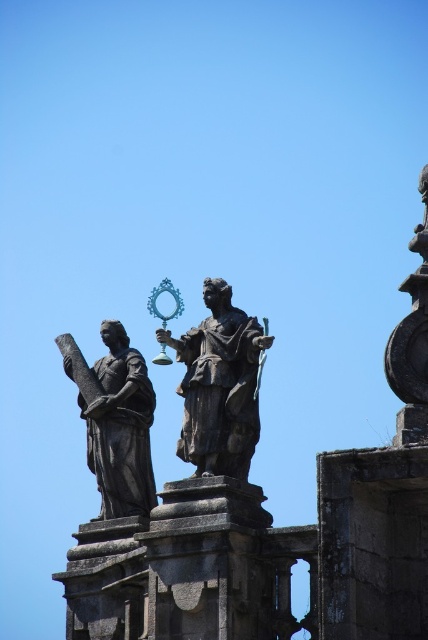
In the scene shown: Is polished bronze statue at center further to camera compared to dark brown stone statue at upper center?

No, it is not.

Does point (217, 358) lie in front of point (133, 504)?

Yes, it is.

The height and width of the screenshot is (640, 428). Identify the location of polished bronze statue at center. (219, 385).